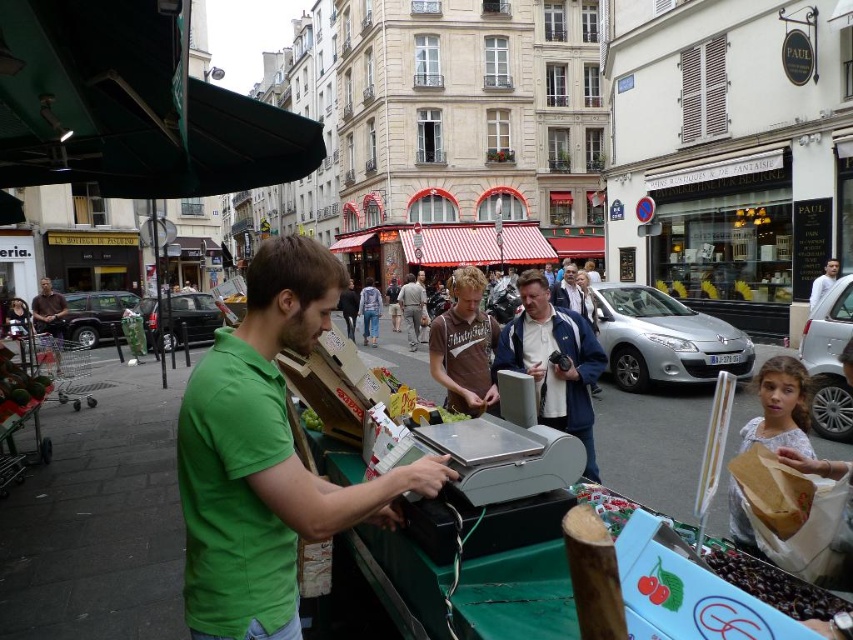
In the scene shown: You are a customer at the fruit stall and want to pay for your cherries. The vendor is wearing a green matte shirt at center and there is a matte gray cash register at center. Which object is closer to you when you are standing at the counter?

The green matte shirt at center is larger in size than the matte gray cash register at center, but their positions at the center do not indicate their distance from you. Without additional spatial information, it is impossible to determine which is closer.